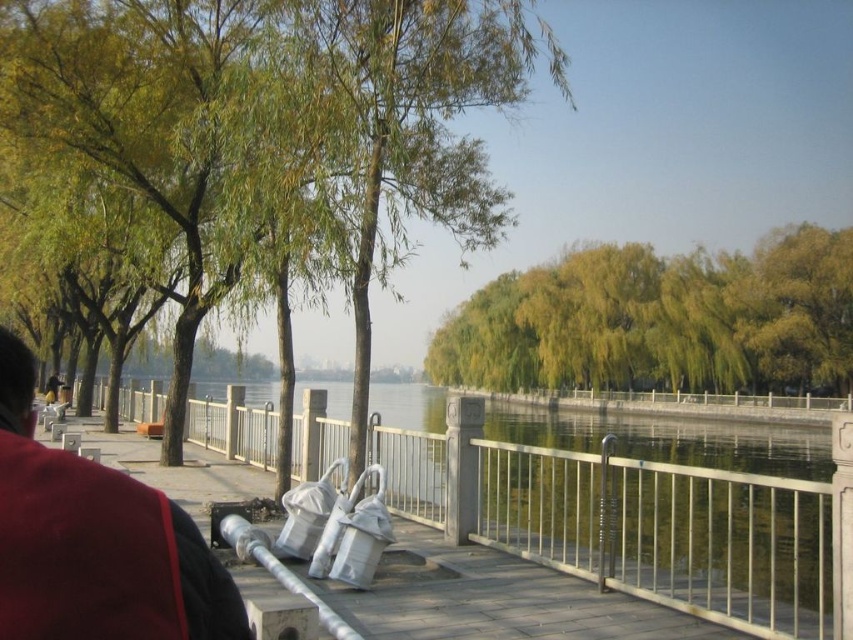
Does point (537, 529) come farther from viewer compared to point (682, 368)?

No, it is not.

Who is more forward, [682,508] or [776,353]?

Point [682,508] is in front.

Where is `green stone river at center`? green stone river at center is located at coordinates (631, 524).

Which is more to the left, green leafy tree at left or yellow-green leaves at center?

From the viewer's perspective, green leafy tree at left appears more on the left side.

Is green leafy tree at left in front of yellow-green leaves at center?

That is True.

Is point (387, 220) closer to camera compared to point (531, 314)?

That is True.

Where is `green leafy tree at left`? Image resolution: width=853 pixels, height=640 pixels. green leafy tree at left is located at coordinates 263,144.

Can you confirm if green leafy tree at left is positioned below green stone river at center?

No.

Find the location of a particular element. The height and width of the screenshot is (640, 853). green leafy tree at left is located at coordinates (263, 144).

You are a GUI agent. You are given a task and a screenshot of the screen. Output one action in this format:
    pyautogui.click(x=<x>, y=<y>)
    Task: Click on the green leafy tree at left
    
    Given the screenshot: What is the action you would take?
    click(263, 144)